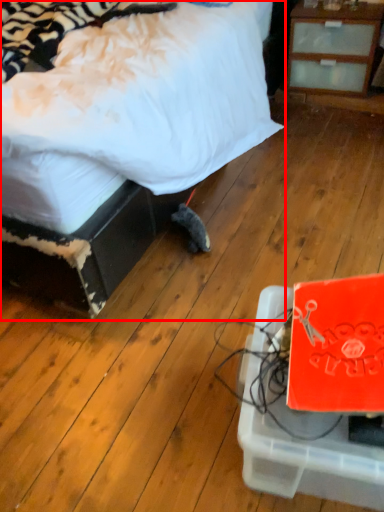
Question: Where is bed (annotated by the red box) located in relation to cardboard box in the image?

Choices:
 (A) right
 (B) left

Answer: (B)